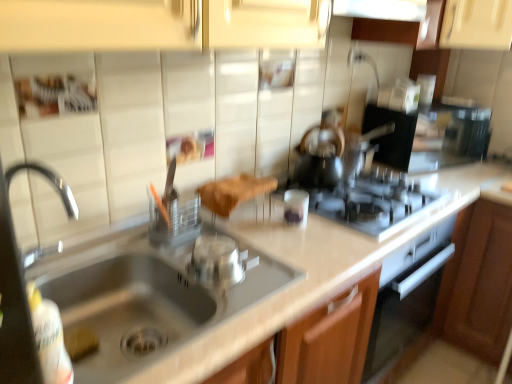
Question: From the image's perspective, is brown wood cabinet at lower right above translucent glass tea pot at center?

Choices:
 (A) yes
 (B) no

Answer: (B)

Question: Is translucent glass tea pot at center completely or partially inside brown wood cabinet at lower right?

Choices:
 (A) yes
 (B) no

Answer: (B)

Question: Can you confirm if brown wood cabinet at lower right is bigger than translucent glass tea pot at center?

Choices:
 (A) no
 (B) yes

Answer: (B)

Question: From a real-world perspective, is brown wood cabinet at lower right positioned over translucent glass tea pot at center based on gravity?

Choices:
 (A) no
 (B) yes

Answer: (A)

Question: Can you confirm if brown wood cabinet at lower right is positioned to the left of translucent glass tea pot at center?

Choices:
 (A) yes
 (B) no

Answer: (B)

Question: In terms of width, does brown fabric at center look wider or thinner when compared to stainless steel sink at lower left?

Choices:
 (A) wide
 (B) thin

Answer: (B)

Question: Is brown fabric at center to the left or to the right of stainless steel sink at lower left in the image?

Choices:
 (A) left
 (B) right

Answer: (B)

Question: In the image, is brown fabric at center positioned in front of or behind stainless steel sink at lower left?

Choices:
 (A) behind
 (B) front

Answer: (A)

Question: From the image's perspective, relative to stainless steel sink at lower left, is brown fabric at center above or below?

Choices:
 (A) below
 (B) above

Answer: (B)

Question: Based on their positions, is stainless steel sink at lower left located to the left or right of satin silver gas stove at center?

Choices:
 (A) left
 (B) right

Answer: (A)

Question: Is stainless steel sink at lower left taller or shorter than satin silver gas stove at center?

Choices:
 (A) tall
 (B) short

Answer: (A)

Question: Is stainless steel sink at lower left wider or thinner than satin silver gas stove at center?

Choices:
 (A) thin
 (B) wide

Answer: (B)

Question: From a real-world perspective, is stainless steel sink at lower left above or below satin silver gas stove at center?

Choices:
 (A) above
 (B) below

Answer: (B)

Question: Considering the relative positions of translucent glass tea pot at center and brown fabric at center in the image provided, is translucent glass tea pot at center to the left or to the right of brown fabric at center?

Choices:
 (A) left
 (B) right

Answer: (B)

Question: Is translucent glass tea pot at center inside or outside of brown fabric at center?

Choices:
 (A) inside
 (B) outside

Answer: (B)